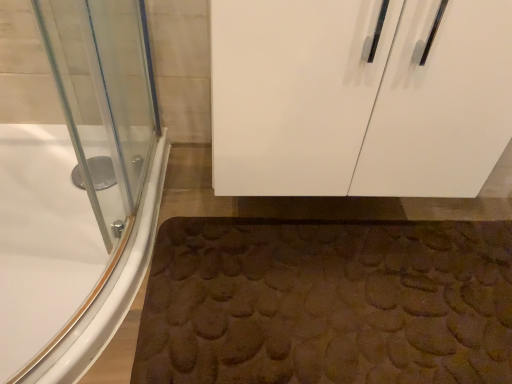
Question: Is brown textured bath mat at lower center inside white glossy cabinet at upper center?

Choices:
 (A) no
 (B) yes

Answer: (A)

Question: Is white glossy cabinet at upper center aimed at brown textured bath mat at lower center?

Choices:
 (A) no
 (B) yes

Answer: (A)

Question: Is white glossy cabinet at upper center behind brown textured bath mat at lower center?

Choices:
 (A) yes
 (B) no

Answer: (B)

Question: Can you confirm if white glossy cabinet at upper center is shorter than brown textured bath mat at lower center?

Choices:
 (A) no
 (B) yes

Answer: (A)

Question: From the image's perspective, is white glossy cabinet at upper center below brown textured bath mat at lower center?

Choices:
 (A) no
 (B) yes

Answer: (A)

Question: Is point (409, 337) closer or farther from the camera than point (111, 286)?

Choices:
 (A) closer
 (B) farther

Answer: (B)

Question: Looking at the image, does brown textured bath mat at lower center seem bigger or smaller compared to white glossy bathtub at lower left?

Choices:
 (A) small
 (B) big

Answer: (A)

Question: Based on their positions, is brown textured bath mat at lower center located to the left or right of white glossy bathtub at lower left?

Choices:
 (A) right
 (B) left

Answer: (A)

Question: Is brown textured bath mat at lower center spatially inside white glossy bathtub at lower left, or outside of it?

Choices:
 (A) inside
 (B) outside

Answer: (B)

Question: Looking at their shapes, would you say brown textured bath mat at lower center is wider or thinner than white glossy cabinet at upper center?

Choices:
 (A) wide
 (B) thin

Answer: (B)

Question: Is brown textured bath mat at lower center taller or shorter than white glossy cabinet at upper center?

Choices:
 (A) short
 (B) tall

Answer: (A)

Question: Does point (152, 296) appear closer or farther from the camera than point (257, 132)?

Choices:
 (A) farther
 (B) closer

Answer: (A)

Question: Is brown textured bath mat at lower center spatially inside white glossy cabinet at upper center, or outside of it?

Choices:
 (A) outside
 (B) inside

Answer: (A)

Question: Considering the positions of white glossy cabinet at upper center and brown textured bath mat at lower center in the image, is white glossy cabinet at upper center bigger or smaller than brown textured bath mat at lower center?

Choices:
 (A) big
 (B) small

Answer: (A)

Question: Is white glossy cabinet at upper center situated inside brown textured bath mat at lower center or outside?

Choices:
 (A) inside
 (B) outside

Answer: (B)